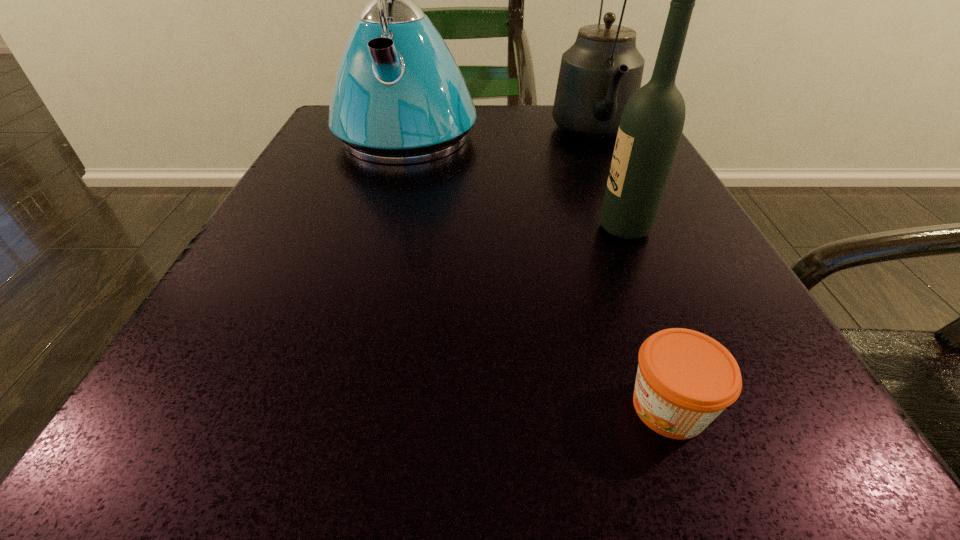
In order to click on object that is positioned at the far right corner in this screenshot , I will do [599, 73].

Where is `object that is at the near right corner`? The image size is (960, 540). object that is at the near right corner is located at coordinates (x=685, y=379).

This screenshot has width=960, height=540. In order to click on vacant region at the far edge of the desktop in this screenshot , I will do `click(553, 140)`.

This screenshot has height=540, width=960. In the image, there is a desktop. What are the coordinates of `vacant space at the near edge` in the screenshot? It's located at (611, 492).

I want to click on free space at the left edge of the desktop, so click(310, 189).

Where is `free location at the right edge`? This screenshot has width=960, height=540. free location at the right edge is located at coordinates (716, 309).

Image resolution: width=960 pixels, height=540 pixels. In the image, there is a desktop. What are the coordinates of `vacant space at the near right corner` in the screenshot? It's located at (709, 448).

Where is `vacant area that lies between the nearest object and the second nearest object`? This screenshot has height=540, width=960. vacant area that lies between the nearest object and the second nearest object is located at coordinates (647, 318).

Locate an element on the screen. The width and height of the screenshot is (960, 540). empty space that is in between the second shortest object and the left kettle is located at coordinates (516, 181).

Image resolution: width=960 pixels, height=540 pixels. In order to click on vacant point located between the leftmost object and the nearest object in this screenshot , I will do `click(538, 270)`.